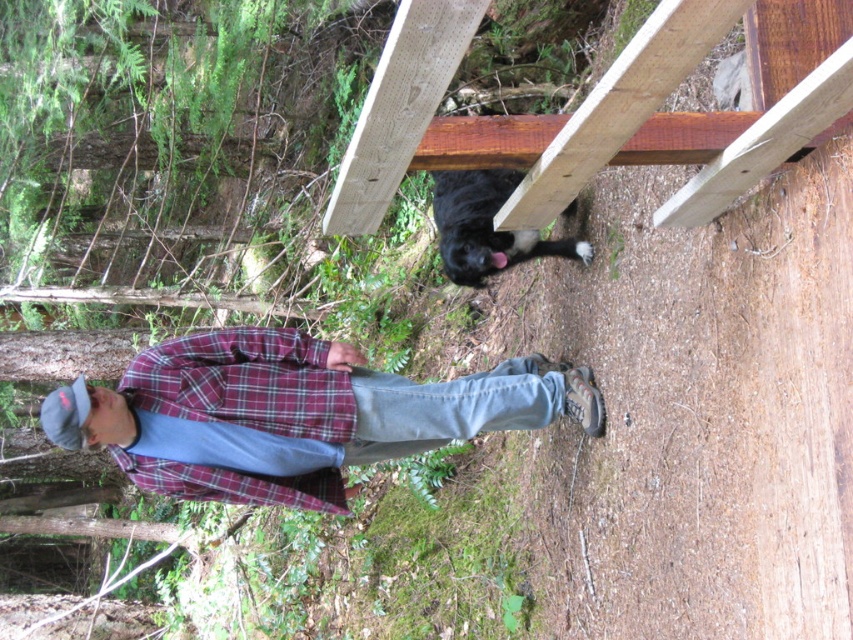
Based on the photo, is plaid flannel shirt at center to the left of plaid fabric at center from the viewer's perspective?

In fact, plaid flannel shirt at center is to the right of plaid fabric at center.

Which is behind, point (381, 422) or point (204, 406)?

Point (381, 422)

Identify the location of plaid flannel shirt at center. The width and height of the screenshot is (853, 640). pyautogui.click(x=300, y=410).